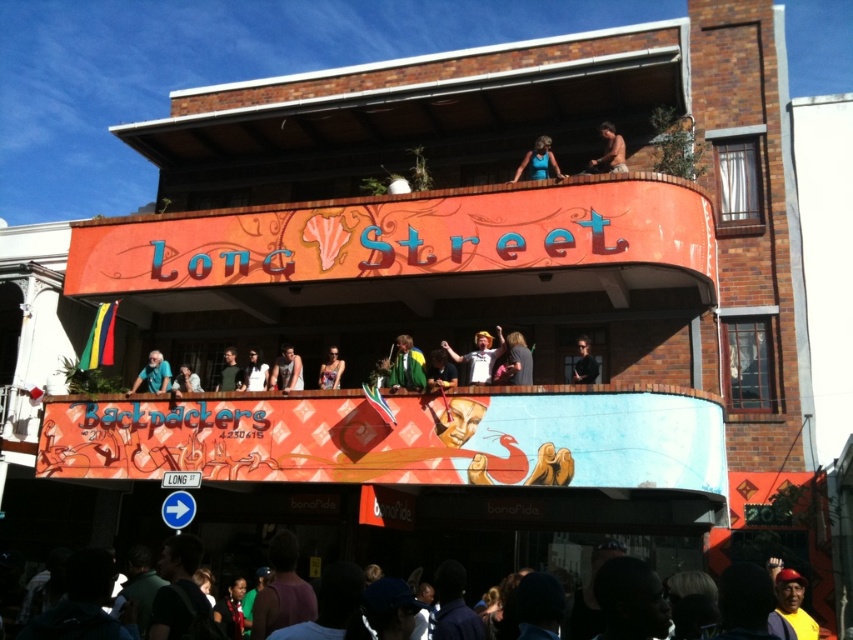
Question: Where is matte black shirt at upper center located in relation to dark blue shirt at center in the image?

Choices:
 (A) right
 (B) left

Answer: (A)

Question: Which point is closer to the camera?

Choices:
 (A) dark brown leather jacket at center
 (B) blue fabric shirt at upper center
 (C) matte black tank top at center

Answer: (A)

Question: Which of the following is the farthest from the observer?

Choices:
 (A) bare skin at upper center
 (B) matte black shirt at upper center
 (C) matte black tank top at center
 (D) matte black jacket at upper center

Answer: (C)

Question: Does green jersey at center have a greater width compared to green fabric flag at center?

Choices:
 (A) no
 (B) yes

Answer: (B)

Question: Can you confirm if dark brown leather jacket at center is smaller than matte black tank top at center?

Choices:
 (A) yes
 (B) no

Answer: (A)

Question: Which point is closer to the camera?

Choices:
 (A) green fabric shirt at center
 (B) matte black tank top at center
 (C) bare skin at upper center

Answer: (C)